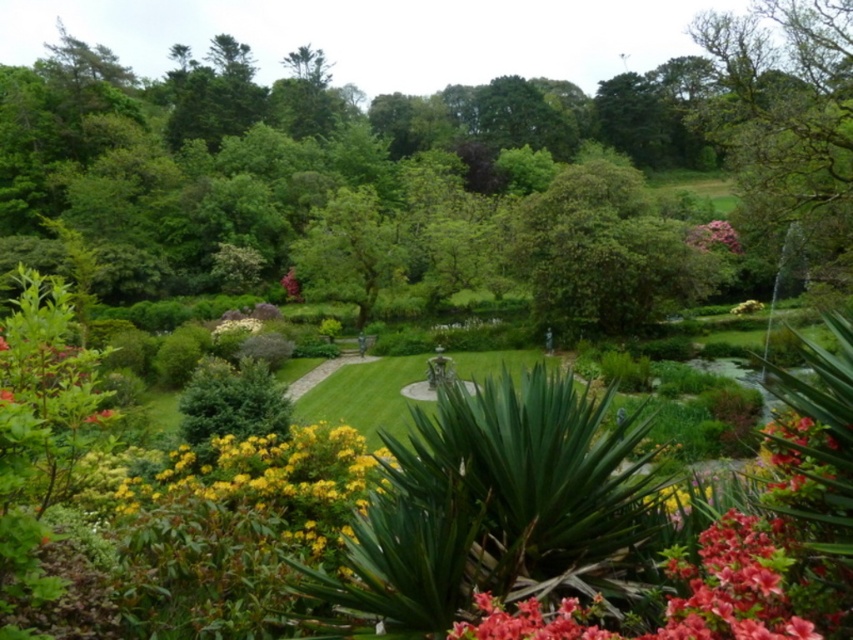
Question: Is yellow matte flowers at center positioned before pink matte flower at upper right?

Choices:
 (A) yes
 (B) no

Answer: (A)

Question: Which object is farther from the camera taking this photo?

Choices:
 (A) pink matte flower at upper right
 (B) vivid red petals at lower right

Answer: (A)

Question: Does green mossy tree at upper right have a smaller size compared to vivid red petals at lower right?

Choices:
 (A) no
 (B) yes

Answer: (A)

Question: Which object is positioned farthest from the vivid red petals at lower right?

Choices:
 (A) yellow matte flowers at center
 (B) yellow matte flower at center
 (C) pink matte flower at upper right

Answer: (B)

Question: Which of these objects is positioned farthest from the pink matte flower at upper right?

Choices:
 (A) vivid red petals at lower right
 (B) yellow matte flower at center
 (C) pink matte flower at center

Answer: (A)

Question: Does green mossy tree at upper right appear under pink matte flower at center?

Choices:
 (A) no
 (B) yes

Answer: (A)